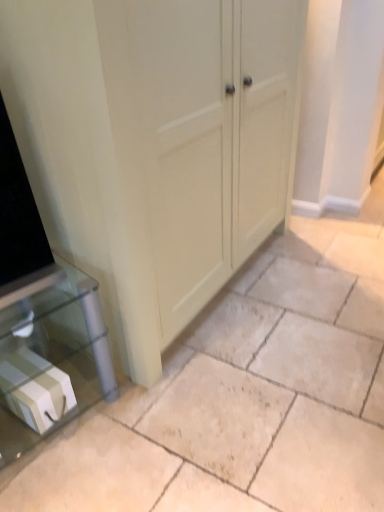
Image resolution: width=384 pixels, height=512 pixels. What are the coordinates of `beige tile floor at center` in the screenshot? It's located at pos(245,396).

From the image's perspective, relative to beige tile floor at center, is matte cream cupboard at center above or below?

matte cream cupboard at center is above beige tile floor at center.

Can we say matte cream cupboard at center lies outside beige tile floor at center?

matte cream cupboard at center lies outside beige tile floor at center's area.

Who is more distant, matte cream cupboard at center or beige tile floor at center?

matte cream cupboard at center is behind.

Is point (166, 115) farther from viewer compared to point (244, 373)?

No, it is not.

From a real-world perspective, which object rests below the other?

beige tile floor at center is physically lower.

I want to click on concrete below the white glossy box at lower left (from a real-world perspective), so click(245, 396).

Is white glossy box at lower left wider or thinner than beige tile floor at center?

Considering their sizes, white glossy box at lower left looks slimmer than beige tile floor at center.

Is white glossy box at lower left with beige tile floor at center?

No.

Is beige tile floor at center facing away from matte cream cupboard at center?

beige tile floor at center does not have its back to matte cream cupboard at center.

From their relative heights in the image, would you say beige tile floor at center is taller or shorter than matte cream cupboard at center?

In the image, beige tile floor at center appears to be shorter than matte cream cupboard at center.

Considering the positions of objects beige tile floor at center and matte cream cupboard at center in the image provided, who is in front, beige tile floor at center or matte cream cupboard at center?

beige tile floor at center.

From the image's perspective, is beige tile floor at center below matte cream cupboard at center?

Yes, from the image's perspective, beige tile floor at center is below matte cream cupboard at center.

Is white glossy box at lower left touching matte cream cupboard at center?

There is a gap between white glossy box at lower left and matte cream cupboard at center.

This screenshot has width=384, height=512. I want to click on cupboard positioned vertically above the white glossy box at lower left (from a real-world perspective), so click(x=155, y=145).

From a real-world perspective, is white glossy box at lower left located higher than matte cream cupboard at center?

No.

Can you confirm if white glossy box at lower left is smaller than matte cream cupboard at center?

Correct, white glossy box at lower left occupies less space than matte cream cupboard at center.

Would you say beige tile floor at center is a long distance from white glossy box at lower left?

That's not correct — beige tile floor at center is a little close to white glossy box at lower left.

From the image's perspective, which is below, beige tile floor at center or white glossy box at lower left?

white glossy box at lower left appears lower in the image.

Consider the image. Is beige tile floor at center outside of white glossy box at lower left?

Yes.

This screenshot has width=384, height=512. Identify the location of furniture that appears below the matte cream cupboard at center (from a real-world perspective). pos(51,360).

From a real-world perspective, who is located higher, matte cream cupboard at center or white glossy box at lower left?

matte cream cupboard at center is physically above.

Looking at this image, does matte cream cupboard at center appear on the left side of white glossy box at lower left?

In fact, matte cream cupboard at center is to the right of white glossy box at lower left.

The height and width of the screenshot is (512, 384). Find the location of `cupboard on the left of beige tile floor at center`. cupboard on the left of beige tile floor at center is located at coordinates (155, 145).

Identify the location of furniture below the beige tile floor at center (from the image's perspective). (51, 360).

Consider the image. When comparing their distances from matte cream cupboard at center, does beige tile floor at center or white glossy box at lower left seem closer?

The object closer to matte cream cupboard at center is white glossy box at lower left.

Looking at the image, which one is located closer to beige tile floor at center, matte cream cupboard at center or white glossy box at lower left?

white glossy box at lower left.

When comparing their distances from white glossy box at lower left, does beige tile floor at center or matte cream cupboard at center seem further?

matte cream cupboard at center.

Which object lies nearer to the anchor point matte cream cupboard at center, white glossy box at lower left or beige tile floor at center?

Among the two, white glossy box at lower left is located nearer to matte cream cupboard at center.

Which object lies nearer to the anchor point beige tile floor at center, white glossy box at lower left or matte cream cupboard at center?

Based on the image, white glossy box at lower left appears to be nearer to beige tile floor at center.

Estimate the real-world distances between objects in this image. Which object is closer to white glossy box at lower left, matte cream cupboard at center or beige tile floor at center?

Based on the image, beige tile floor at center appears to be nearer to white glossy box at lower left.

The width and height of the screenshot is (384, 512). In order to click on cupboard situated between white glossy box at lower left and beige tile floor at center from left to right in this screenshot , I will do `click(155, 145)`.